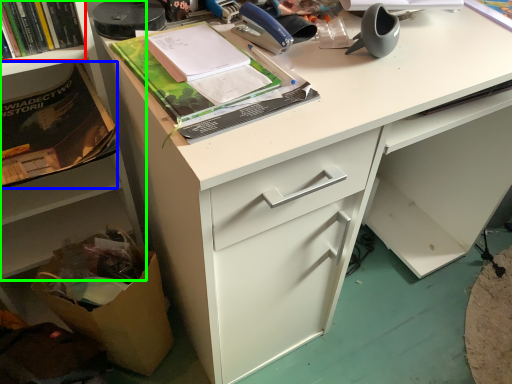
Question: Considering the real-world distances, which object is farthest from book (highlighted by a red box)? paperback book (highlighted by a blue box) or cabinetry (highlighted by a green box)?

Choices:
 (A) paperback book
 (B) cabinetry

Answer: (B)